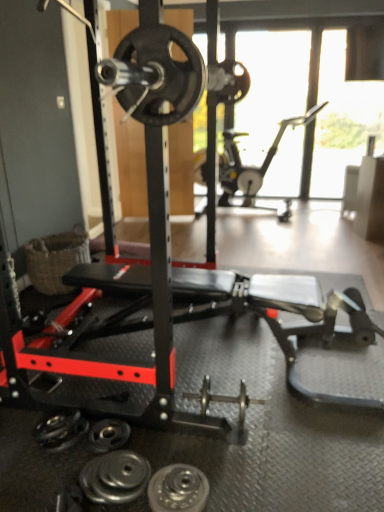
Question: Looking at their shapes, would you say black rubber weight plate at lower center, the 1th wheel viewed from the back, is wider or thinner than black rubberized training bench at center?

Choices:
 (A) wide
 (B) thin

Answer: (B)

Question: Based on their sizes in the image, would you say black rubber weight plate at lower center, the 1th wheel viewed from the back, is bigger or smaller than black rubberized training bench at center?

Choices:
 (A) big
 (B) small

Answer: (B)

Question: Which is nearer to the metallic silver exercise bike at upper right?

Choices:
 (A) black rubberized training bench at center
 (B) woven brown basket at lower left
 (C) polished silver dumbbell at lower left, arranged as the 2th dumbbell when viewed from the top
 (D) black rubber weight plate at lower center, the 1th wheel viewed from the back
 (E) polished silver dumbbell at center, acting as the second dumbbell starting from the front

Answer: (B)

Question: Which object is the farthest from the polished silver dumbbell at center, the first dumbbell viewed from the right?

Choices:
 (A) woven brown basket at lower left
 (B) polished silver dumbbell at lower left, acting as the 1th dumbbell starting from the front
 (C) black rubber weight plate at lower center, the second wheel when ordered from right to left
 (D) silver metallic weight plate at lower center, the 2th wheel positioned from the back
 (E) metallic silver exercise bike at upper right

Answer: (E)